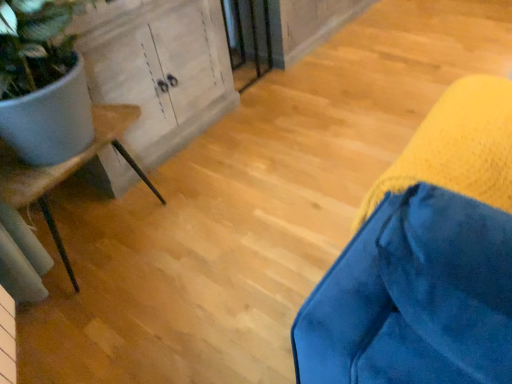
Question: Would you consider velvet blue cushion at lower right, which is the second furniture from left to right, to be distant from wooden cabinet at left?

Choices:
 (A) yes
 (B) no

Answer: (A)

Question: From a real-world perspective, is velvet blue cushion at lower right, the 2th furniture in the back-to-front sequence, located beneath wooden cabinet at left?

Choices:
 (A) no
 (B) yes

Answer: (A)

Question: Is wooden cabinet at left at the back of velvet blue cushion at lower right, which is the 1th furniture from right to left?

Choices:
 (A) no
 (B) yes

Answer: (B)

Question: Is the position of velvet blue cushion at lower right, placed as the 1th furniture when sorted from front to back, more distant than that of wooden cabinet at left?

Choices:
 (A) yes
 (B) no

Answer: (B)

Question: Considering the relative sizes of velvet blue cushion at lower right, placed as the 1th furniture when sorted from front to back, and wooden cabinet at left in the image provided, is velvet blue cushion at lower right, placed as the 1th furniture when sorted from front to back, smaller than wooden cabinet at left?

Choices:
 (A) no
 (B) yes

Answer: (B)

Question: Is velvet blue cushion at lower right, which is the second furniture from left to right, taller than wooden cabinet at left?

Choices:
 (A) no
 (B) yes

Answer: (A)

Question: Considering the relative sizes of velvet blue cushion at lower right, which is the 1th furniture from right to left, and wooden screen door at center in the image provided, is velvet blue cushion at lower right, which is the 1th furniture from right to left, bigger than wooden screen door at center?

Choices:
 (A) yes
 (B) no

Answer: (B)

Question: Is velvet blue cushion at lower right, the 2th furniture in the back-to-front sequence, outside wooden screen door at center?

Choices:
 (A) no
 (B) yes

Answer: (B)

Question: Is velvet blue cushion at lower right, which is the second furniture from left to right, facing towards wooden screen door at center?

Choices:
 (A) no
 (B) yes

Answer: (A)

Question: Is velvet blue cushion at lower right, placed as the 1th furniture when sorted from front to back, not near wooden screen door at center?

Choices:
 (A) yes
 (B) no

Answer: (A)

Question: Is velvet blue cushion at lower right, placed as the 1th furniture when sorted from front to back, facing away from wooden screen door at center?

Choices:
 (A) yes
 (B) no

Answer: (B)

Question: Is velvet blue cushion at lower right, the 2th furniture in the back-to-front sequence, closer to camera compared to wooden screen door at center?

Choices:
 (A) no
 (B) yes

Answer: (B)

Question: Considering the relative positions of wooden screen door at center and velvet blue cushion at lower right, the 2th furniture in the back-to-front sequence, in the image provided, is wooden screen door at center to the right of velvet blue cushion at lower right, the 2th furniture in the back-to-front sequence, from the viewer's perspective?

Choices:
 (A) no
 (B) yes

Answer: (A)